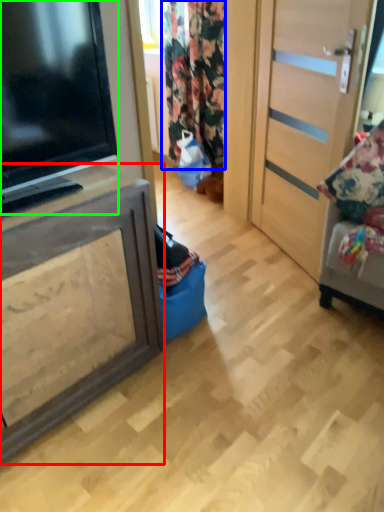
Question: Which object is the farthest from cabinetry (highlighted by a red box)? Choose among these: curtain (highlighted by a blue box) or television (highlighted by a green box).

Choices:
 (A) curtain
 (B) television

Answer: (A)